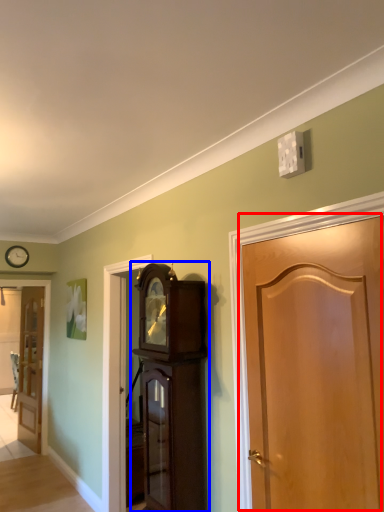
Question: Which object appears closest to the camera in this image, door (highlighted by a red box) or cabinetry (highlighted by a blue box)?

Choices:
 (A) door
 (B) cabinetry

Answer: (A)